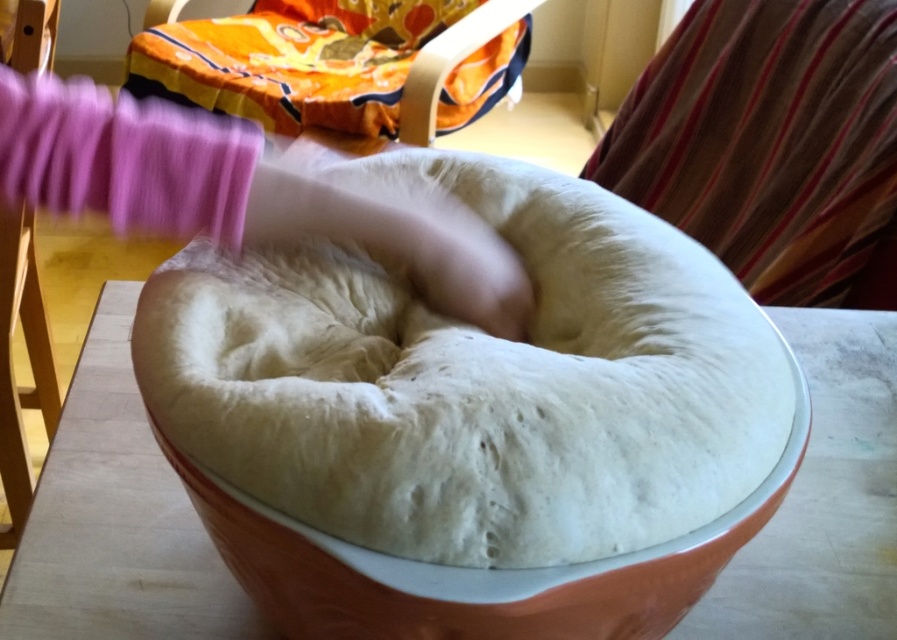
Between white dough at center and white glossy bowl at center, which one has less height?

Standing shorter between the two is white glossy bowl at center.

Does point (407, 509) come in front of point (44, 534)?

Yes, it is.

At what (x,y) coordinates should I click in order to perform the action: click on white dough at center. Please return your answer as a coordinate pair (x, y). This screenshot has height=640, width=897. Looking at the image, I should click on (475, 381).

Where is `white dough at center`? Image resolution: width=897 pixels, height=640 pixels. white dough at center is located at coordinates (475, 381).

Does white dough at center have a lesser height compared to orange fabric cushion at upper left?

Indeed, white dough at center has a lesser height compared to orange fabric cushion at upper left.

Is point (335, 314) positioned behind point (501, 61)?

No, it is in front of (501, 61).

Is point (669, 396) positioned behind point (190, 29)?

No, (669, 396) is in front of (190, 29).

Locate an element on the screen. white dough at center is located at coordinates 475,381.

Which is more to the left, white glossy bowl at center or orange fabric cushion at upper left?

From the viewer's perspective, orange fabric cushion at upper left appears more on the left side.

Can you confirm if white glossy bowl at center is thinner than orange fabric cushion at upper left?

Correct, white glossy bowl at center's width is less than orange fabric cushion at upper left's.

What do you see at coordinates (116, 520) in the screenshot?
I see `white glossy bowl at center` at bounding box center [116, 520].

I want to click on white glossy bowl at center, so click(x=116, y=520).